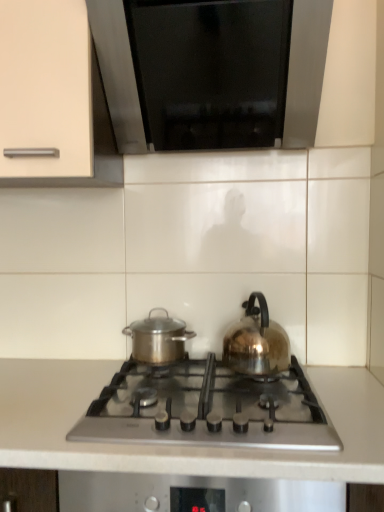
The width and height of the screenshot is (384, 512). Find the location of `blank space situated above satin silver gas stove at center (from a real-world perspective)`. blank space situated above satin silver gas stove at center (from a real-world perspective) is located at coordinates (195, 372).